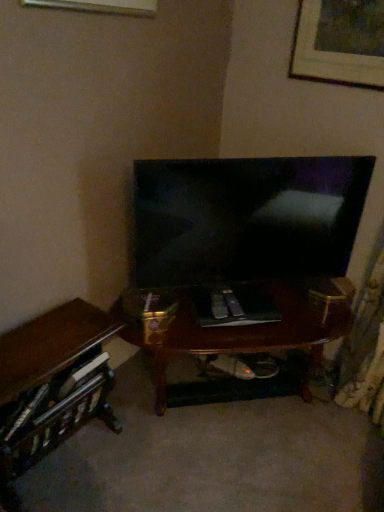
Question: Is wooden picture frame at upper right in front of or behind wooden desk at lower left in the image?

Choices:
 (A) behind
 (B) front

Answer: (A)

Question: Based on their sizes in the image, would you say wooden picture frame at upper right is bigger or smaller than wooden desk at lower left?

Choices:
 (A) big
 (B) small

Answer: (B)

Question: Based on their relative distances, which object is nearer to the wooden desk at lower left?

Choices:
 (A) matte black tv at center
 (B) wooden picture frame at upper right

Answer: (A)

Question: Which is farther from the wooden picture frame at upper right?

Choices:
 (A) matte black tv at center
 (B) wooden desk at lower left

Answer: (B)